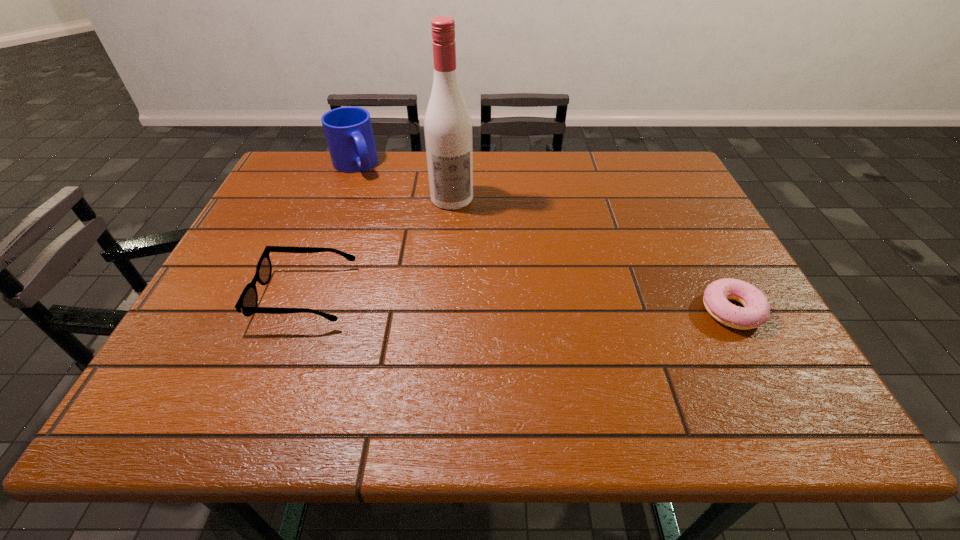
At what (x,y) coordinates should I click in order to perform the action: click on spectacles. Please return your answer as a coordinate pair (x, y). Looking at the image, I should click on (247, 303).

The image size is (960, 540). I want to click on the shortest object, so click(756, 310).

At what (x,y) coordinates should I click in order to perform the action: click on the rightmost object. Please return your answer as a coordinate pair (x, y). This screenshot has height=540, width=960. Looking at the image, I should click on (756, 310).

The width and height of the screenshot is (960, 540). I want to click on the second object from right to left, so [448, 134].

This screenshot has height=540, width=960. What are the coordinates of `the tallest object` in the screenshot? It's located at (448, 134).

Find the location of a particular element. mug is located at coordinates (348, 130).

Where is `the farthest object`? the farthest object is located at coordinates (348, 130).

Image resolution: width=960 pixels, height=540 pixels. What are the coordinates of `vacant area located on the arms of the spectacles` in the screenshot? It's located at (229, 295).

Identify the location of vacant space located 0.120m on the arms of the spectacles. The height and width of the screenshot is (540, 960). (205, 295).

Identify the location of vacant region located on the arms of the spectacles. (220, 295).